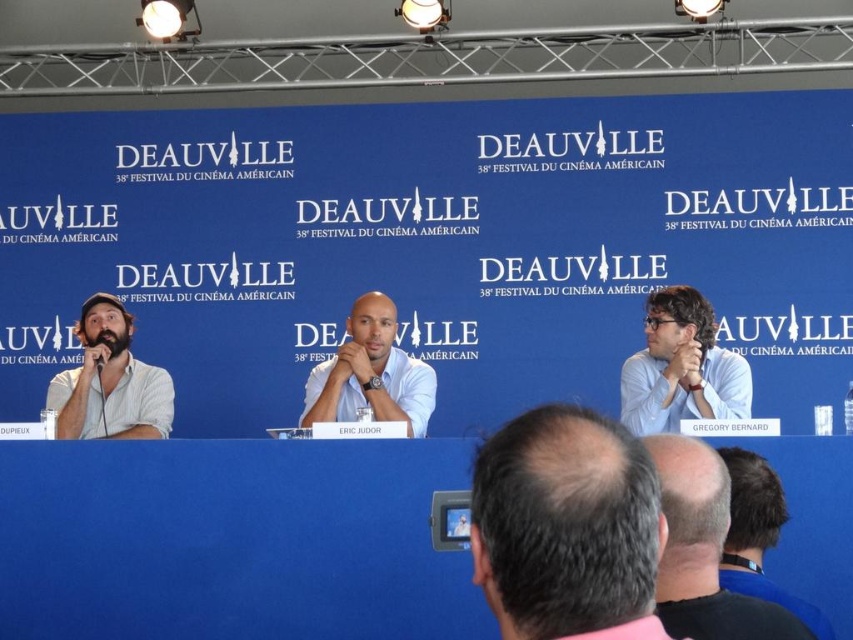
Can you confirm if matte gray shirt at right is positioned to the left of dark blue shirt at lower right?

Indeed, matte gray shirt at right is positioned on the left side of dark blue shirt at lower right.

Does matte gray shirt at right have a lesser height compared to dark blue shirt at lower right?

No, matte gray shirt at right is not shorter than dark blue shirt at lower right.

Does point (714, 376) come behind point (759, 472)?

Yes.

Where is `matte gray shirt at right`? The width and height of the screenshot is (853, 640). matte gray shirt at right is located at coordinates (682, 368).

Is gray hair at center bigger than matte gray shirt at right?

No.

Can you confirm if gray hair at center is taller than matte gray shirt at right?

Yes.

The image size is (853, 640). Identify the location of gray hair at center. (566, 528).

Consider the image. Is gray hair at center wider than dark blue shirt at lower right?

Yes, gray hair at center is wider than dark blue shirt at lower right.

Between point (488, 524) and point (747, 592), which one is positioned in front?

Point (488, 524) is in front.

Is point (579, 492) positioned after point (734, 582)?

No, (579, 492) is in front of (734, 582).

What are the coordinates of `gray hair at center` in the screenshot? It's located at (566, 528).